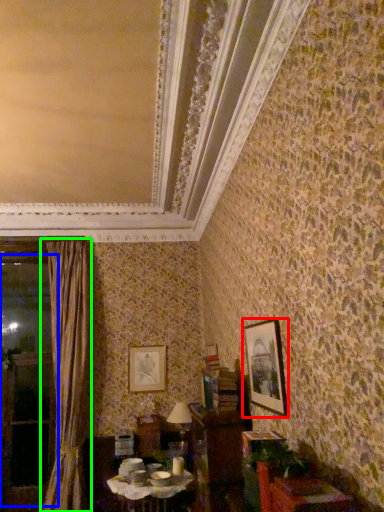
Question: Which is farther away from picture frame (highlighted by a red box)? window (highlighted by a blue box) or curtain (highlighted by a green box)?

Choices:
 (A) window
 (B) curtain

Answer: (A)